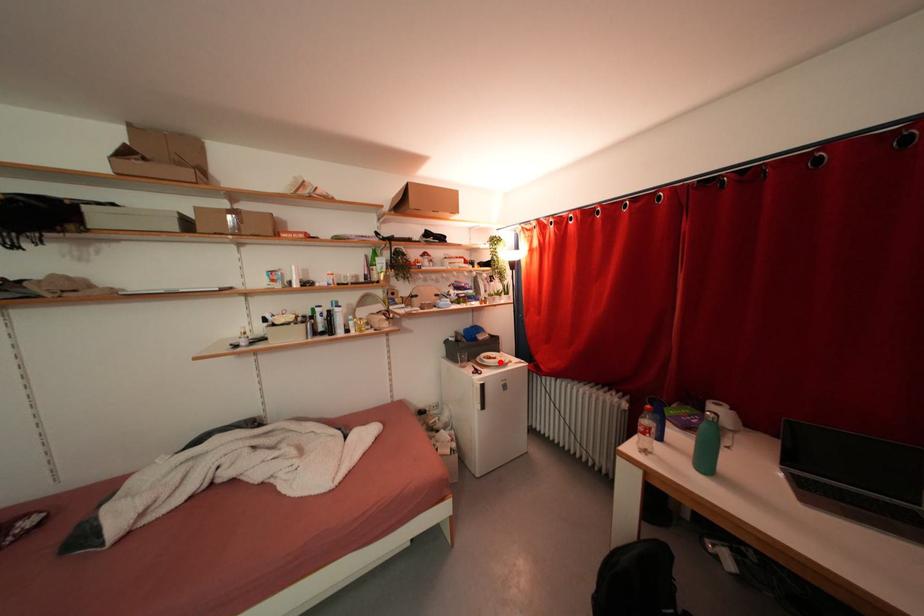
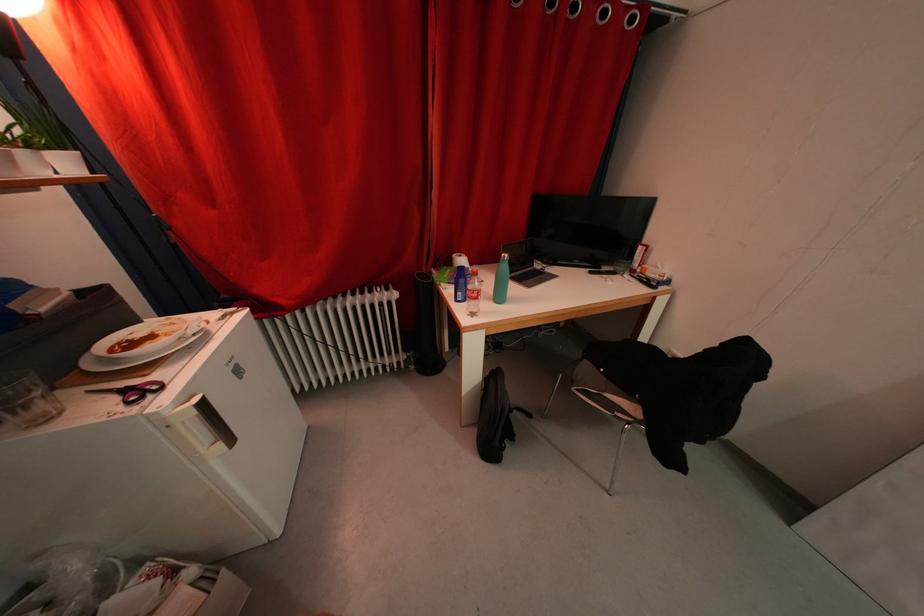
Where in the second image is the point corresponding to the highlighted location from the first image?

(157, 341)